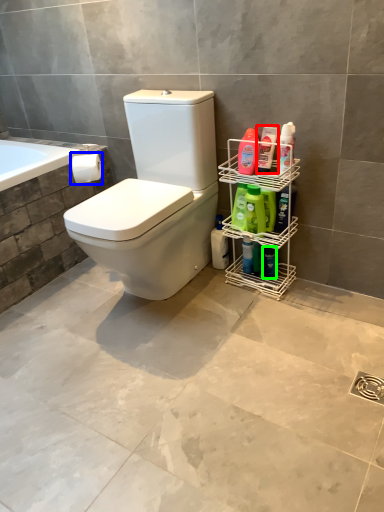
Question: Based on their relative distances, which object is farther from cleaning product (highlighted by a red box)? Choose from toilet paper (highlighted by a blue box) and toiletry (highlighted by a green box).

Choices:
 (A) toilet paper
 (B) toiletry

Answer: (A)